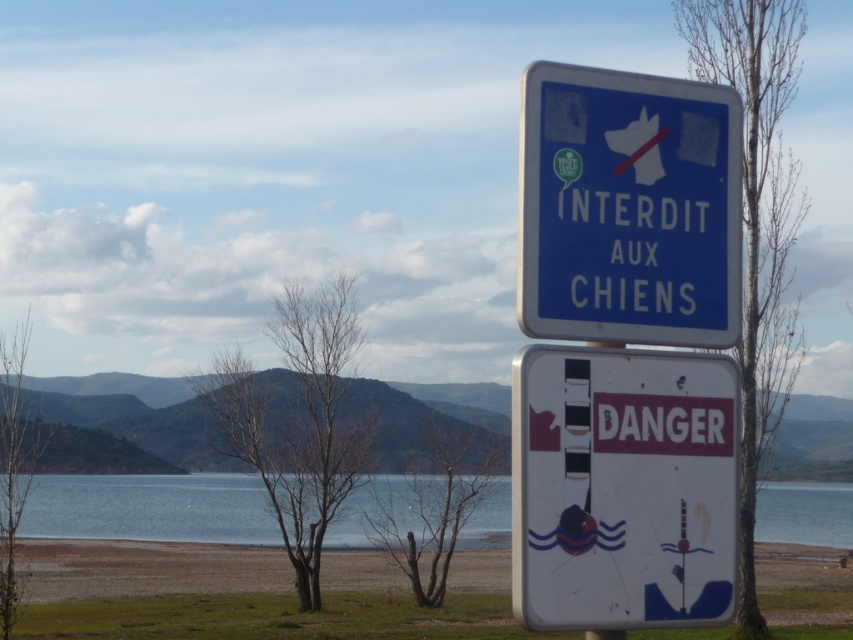
Which of these two, blue plastic sign at center or blue water at lower center, stands taller?

blue water at lower center is taller.

Which of these two, blue plastic sign at center or blue water at lower center, stands shorter?

blue plastic sign at center

Between point (682, 184) and point (184, 492), which one is positioned in front?

Positioned in front is point (682, 184).

In order to click on blue plastic sign at center in this screenshot , I will do `click(628, 208)`.

Can you confirm if white plastic danger sign at center is bigger than blue water at lower center?

No.

How much distance is there between white plastic danger sign at center and blue water at lower center?

33.66 meters

Between point (541, 376) and point (125, 497), which one is positioned in front?

Point (541, 376) is more forward.

The width and height of the screenshot is (853, 640). In order to click on white plastic danger sign at center in this screenshot , I will do [x=624, y=488].

Is point (527, 371) positioned before point (692, 296)?

Yes, point (527, 371) is in front of point (692, 296).

This screenshot has height=640, width=853. In order to click on white plastic danger sign at center in this screenshot , I will do `click(624, 488)`.

Is point (724, 496) farther from camera compared to point (547, 61)?

Yes, it is behind point (547, 61).

The image size is (853, 640). In order to click on white plastic danger sign at center in this screenshot , I will do `click(624, 488)`.